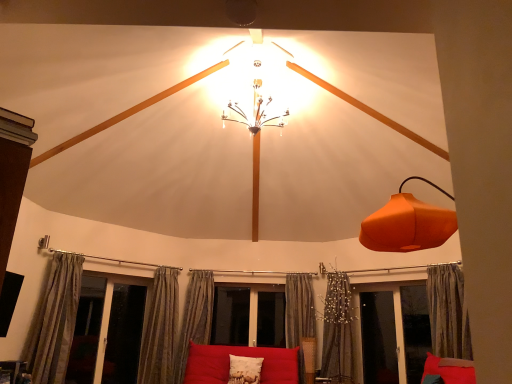
The height and width of the screenshot is (384, 512). In order to click on orange matte lampshade at right in this screenshot , I will do `click(325, 17)`.

Describe the element at coordinates (241, 355) in the screenshot. I see `matte red couch at center` at that location.

What do you see at coordinates (244, 370) in the screenshot? I see `white textured pillow at center` at bounding box center [244, 370].

In order to click on transparent glass screen door at lower right, which is the first screen door in right-to-left order in this screenshot , I will do `click(394, 335)`.

Does point (59, 311) lie in front of point (332, 296)?

Yes, point (59, 311) is closer to viewer.

Who is more distant, textured beige curtain at left, the 6th curtain when ordered from right to left, or silky gray curtain at lower center, the fifth curtain when ordered from left to right?

Positioned behind is silky gray curtain at lower center, the fifth curtain when ordered from left to right.

Does textured beige curtain at left, the 6th curtain when ordered from right to left, appear on the left side of silky gray curtain at lower center, positioned as the 2th curtain in right-to-left order?

Indeed, textured beige curtain at left, the 6th curtain when ordered from right to left, is positioned on the left side of silky gray curtain at lower center, positioned as the 2th curtain in right-to-left order.

Is textured beige curtain at left, positioned as the first curtain in left-to-right order, oriented towards silky gray curtain at lower center, the fifth curtain when ordered from left to right?

No, textured beige curtain at left, positioned as the first curtain in left-to-right order, does not turn towards silky gray curtain at lower center, the fifth curtain when ordered from left to right.

Considering the sizes of objects transparent glass screen door at lower right, which appears as the 2th screen door when viewed from the right, and silky gray curtain at lower center, positioned as the 2th curtain in right-to-left order, in the image provided, who is thinner, transparent glass screen door at lower right, which appears as the 2th screen door when viewed from the right, or silky gray curtain at lower center, positioned as the 2th curtain in right-to-left order,?

transparent glass screen door at lower right, which appears as the 2th screen door when viewed from the right, is thinner.

Considering the positions of objects transparent glass screen door at lower right, which appears as the 2th screen door when viewed from the right, and silky gray curtain at lower center, the fifth curtain when ordered from left to right, in the image provided, who is more to the left, transparent glass screen door at lower right, which appears as the 2th screen door when viewed from the right, or silky gray curtain at lower center, the fifth curtain when ordered from left to right,?

Positioned to the left is silky gray curtain at lower center, the fifth curtain when ordered from left to right.

Who is taller, transparent glass screen door at lower right, which appears as the 2th screen door when viewed from the right, or silky gray curtain at lower center, positioned as the 2th curtain in right-to-left order?

Standing taller between the two is silky gray curtain at lower center, positioned as the 2th curtain in right-to-left order.

Is silky gray curtain at lower center, positioned as the 2th curtain in right-to-left order, inside transparent glass screen door at lower right, arranged as the second screen door when viewed from the left?

No, transparent glass screen door at lower right, arranged as the second screen door when viewed from the left, does not contain silky gray curtain at lower center, positioned as the 2th curtain in right-to-left order.

Considering the positions of objects matte red couch at center and transparent glass screen door at lower right, which is the first screen door in right-to-left order, in the image provided, who is more to the right, matte red couch at center or transparent glass screen door at lower right, which is the first screen door in right-to-left order,?

transparent glass screen door at lower right, which is the first screen door in right-to-left order, is more to the right.

Is transparent glass screen door at lower right, marked as the 3th screen door in a left-to-right arrangement, inside matte red couch at center?

No, transparent glass screen door at lower right, marked as the 3th screen door in a left-to-right arrangement, is not a part of matte red couch at center.

Could you measure the distance between matte red couch at center and transparent glass screen door at lower right, marked as the 3th screen door in a left-to-right arrangement?

The distance of matte red couch at center from transparent glass screen door at lower right, marked as the 3th screen door in a left-to-right arrangement, is 1.63 meters.

Looking at this image, who is smaller, matte red couch at center or transparent glass screen door at lower right, which is the first screen door in right-to-left order?

transparent glass screen door at lower right, which is the first screen door in right-to-left order, is smaller.

Can you see silky gray curtain at center, acting as the third curtain starting from the right, touching transparent glass screen door at lower left, arranged as the 1th screen door when viewed from the left?

No, silky gray curtain at center, acting as the third curtain starting from the right, is not beside transparent glass screen door at lower left, arranged as the 1th screen door when viewed from the left.

From the picture: Which of these two, silky gray curtain at center, the 4th curtain viewed from the left, or transparent glass screen door at lower left, the 3th screen door positioned from the right, is thinner?

transparent glass screen door at lower left, the 3th screen door positioned from the right.

Is silky gray curtain at center, the 4th curtain viewed from the left, turned away from transparent glass screen door at lower left, the 3th screen door positioned from the right?

No, transparent glass screen door at lower left, the 3th screen door positioned from the right, is not at the back of silky gray curtain at center, the 4th curtain viewed from the left.

Considering the relative sizes of silky gray curtain at center, acting as the third curtain starting from the right, and transparent glass screen door at lower left, arranged as the 1th screen door when viewed from the left, in the image provided, is silky gray curtain at center, acting as the third curtain starting from the right, bigger than transparent glass screen door at lower left, arranged as the 1th screen door when viewed from the left,?

No.

Which of these two, textured beige curtain at lower center, marked as the 4th curtain in a right-to-left arrangement, or matte red couch at center, stands taller?

textured beige curtain at lower center, marked as the 4th curtain in a right-to-left arrangement, is taller.

Which is farther, (191, 330) or (219, 381)?

The point (191, 330) is farther.

Is textured beige curtain at lower center, placed as the third curtain when sorted from left to right, facing towards matte red couch at center?

No, textured beige curtain at lower center, placed as the third curtain when sorted from left to right, does not turn towards matte red couch at center.

Is matte red couch at center completely or partially inside textured beige curtain at lower center, placed as the third curtain when sorted from left to right?

Definitely not — matte red couch at center is not inside textured beige curtain at lower center, placed as the third curtain when sorted from left to right.

Which object is positioned more to the left, orange matte lampshade at right or silky gray curtain at lower center, the fifth curtain when ordered from left to right?

orange matte lampshade at right.

Which is behind, point (155, 13) or point (343, 350)?

The point (343, 350) is farther.

Considering the sizes of objects orange matte lampshade at right and silky gray curtain at lower center, the fifth curtain when ordered from left to right, in the image provided, who is smaller, orange matte lampshade at right or silky gray curtain at lower center, the fifth curtain when ordered from left to right,?

With smaller size is silky gray curtain at lower center, the fifth curtain when ordered from left to right.

Considering the sizes of objects orange matte lampshade at right and silky gray curtain at lower center, the fifth curtain when ordered from left to right, in the image provided, who is shorter, orange matte lampshade at right or silky gray curtain at lower center, the fifth curtain when ordered from left to right,?

orange matte lampshade at right is shorter.

Considering the sizes of objects textured beige curtain at lower center, placed as the third curtain when sorted from left to right, and transparent glass screen door at lower left, arranged as the 1th screen door when viewed from the left, in the image provided, who is wider, textured beige curtain at lower center, placed as the third curtain when sorted from left to right, or transparent glass screen door at lower left, arranged as the 1th screen door when viewed from the left,?

With larger width is textured beige curtain at lower center, placed as the third curtain when sorted from left to right.

Is textured beige curtain at lower center, placed as the third curtain when sorted from left to right, oriented away from transparent glass screen door at lower left, arranged as the 1th screen door when viewed from the left?

No, textured beige curtain at lower center, placed as the third curtain when sorted from left to right, is not facing away from transparent glass screen door at lower left, arranged as the 1th screen door when viewed from the left.

Considering the positions of objects textured beige curtain at lower center, placed as the third curtain when sorted from left to right, and transparent glass screen door at lower left, the 3th screen door positioned from the right, in the image provided, who is more to the right, textured beige curtain at lower center, placed as the third curtain when sorted from left to right, or transparent glass screen door at lower left, the 3th screen door positioned from the right,?

From the viewer's perspective, textured beige curtain at lower center, placed as the third curtain when sorted from left to right, appears more on the right side.

Is textured beige curtain at lower center, marked as the 4th curtain in a right-to-left arrangement, behind transparent glass screen door at lower left, arranged as the 1th screen door when viewed from the left?

Yes, textured beige curtain at lower center, marked as the 4th curtain in a right-to-left arrangement, is behind transparent glass screen door at lower left, arranged as the 1th screen door when viewed from the left.

At what (x,y) coordinates should I click in order to perform the action: click on curtain that is the 3rd object located behind the textured beige curtain at left, the 6th curtain when ordered from right to left. Please return your answer as a coordinate pair (x, y). Looking at the image, I should click on (338, 331).

Locate an element on the screen. the 1st screen door counting from the right side of the silky gray curtain at lower center, the fifth curtain when ordered from left to right is located at coordinates (379, 338).

When comparing their distances from white textured pillow at center, does silky gray curtain at lower center, positioned as the 2th curtain in right-to-left order, or transparent glass screen door at lower right, which is the first screen door in right-to-left order, seem closer?

silky gray curtain at lower center, positioned as the 2th curtain in right-to-left order, is closer to white textured pillow at center.

Looking at this image, considering their positions, is transparent glass screen door at lower right, marked as the 3th screen door in a left-to-right arrangement, positioned further to silky gray curtain at lower right, which appears as the 6th curtain when viewed from the left, than transparent glass screen door at lower left, arranged as the 1th screen door when viewed from the left?

Among the two, transparent glass screen door at lower left, arranged as the 1th screen door when viewed from the left, is located further to silky gray curtain at lower right, which appears as the 6th curtain when viewed from the left.

Based on their spatial positions, is transparent glass screen door at lower right, which is the first screen door in right-to-left order, or textured beige curtain at left, the 6th curtain when ordered from right to left, further from transparent glass screen door at lower left, the 3th screen door positioned from the right?

Among the two, transparent glass screen door at lower right, which is the first screen door in right-to-left order, is located further to transparent glass screen door at lower left, the 3th screen door positioned from the right.

From the image, which object appears to be nearer to textured beige curtain at left, positioned as the first curtain in left-to-right order, silky gray curtain at lower center, positioned as the 2th curtain in right-to-left order, or orange matte lampshade at right?

silky gray curtain at lower center, positioned as the 2th curtain in right-to-left order, is positioned closer to the anchor textured beige curtain at left, positioned as the first curtain in left-to-right order.

Which object lies further to the anchor point white textured pillow at center, silky beige curtain at lower left, positioned as the fifth curtain in right-to-left order, or transparent glass screen door at lower right, marked as the 3th screen door in a left-to-right arrangement?

transparent glass screen door at lower right, marked as the 3th screen door in a left-to-right arrangement, lies further to white textured pillow at center than the other object.

From the image, which object appears to be farther from silky gray curtain at center, acting as the third curtain starting from the right, textured beige curtain at left, positioned as the first curtain in left-to-right order, or matte red couch at center?

textured beige curtain at left, positioned as the first curtain in left-to-right order.

In the scene shown: When comparing their distances from textured beige curtain at lower center, marked as the 4th curtain in a right-to-left arrangement, does white textured pillow at center or orange matte lampshade at right seem further?

orange matte lampshade at right is further to textured beige curtain at lower center, marked as the 4th curtain in a right-to-left arrangement.

Estimate the real-world distances between objects in this image. Which object is closer to silky gray curtain at center, acting as the third curtain starting from the right, transparent glass screen door at lower right, arranged as the second screen door when viewed from the left, or textured beige curtain at left, positioned as the first curtain in left-to-right order?

transparent glass screen door at lower right, arranged as the second screen door when viewed from the left, is positioned closer to the anchor silky gray curtain at center, acting as the third curtain starting from the right.

Identify the location of screen door located between matte red couch at center and transparent glass screen door at lower right, marked as the 3th screen door in a left-to-right arrangement, in the left-right direction. (379, 338).

At what (x,y) coordinates should I click in order to perform the action: click on pillow positioned between orange matte lampshade at right and textured beige curtain at lower center, placed as the third curtain when sorted from left to right, from near to far. Please return your answer as a coordinate pair (x, y). The width and height of the screenshot is (512, 384). Looking at the image, I should click on (244, 370).

This screenshot has width=512, height=384. I want to click on pillow located between matte red couch at center and transparent glass screen door at lower right, which appears as the 2th screen door when viewed from the right, in the left-right direction, so click(244, 370).

Locate an element on the screen. curtain between matte red couch at center and silky gray curtain at lower center, the fifth curtain when ordered from left to right, in the horizontal direction is located at coordinates (298, 315).